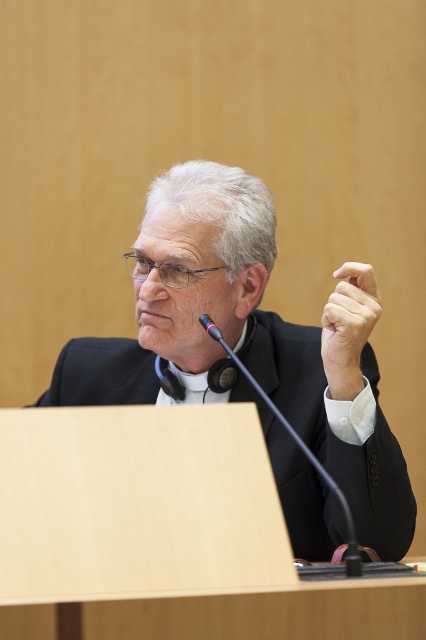
Measure the distance between black matte suit at center and smooth skin hand at center.

The distance of black matte suit at center from smooth skin hand at center is 8.70 inches.

Is black matte suit at center behind smooth skin hand at center?

Yes.

Which is behind, point (383, 508) or point (334, 273)?

The point (383, 508) is behind.

The image size is (426, 640). I want to click on black matte suit at center, so click(x=244, y=358).